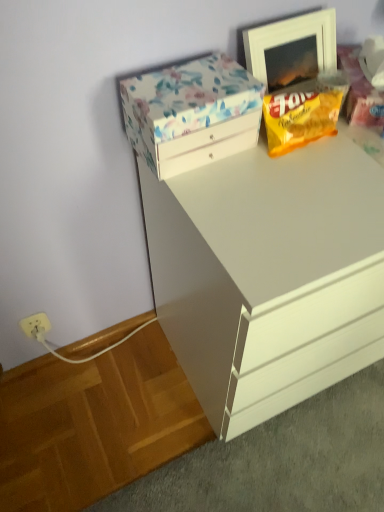
Question: Considering the positions of white glossy chest of drawers at upper center and floral-patterned cardboard box at upper left in the image, is white glossy chest of drawers at upper center taller or shorter than floral-patterned cardboard box at upper left?

Choices:
 (A) short
 (B) tall

Answer: (B)

Question: Looking at the image, does white glossy chest of drawers at upper center seem bigger or smaller compared to floral-patterned cardboard box at upper left?

Choices:
 (A) big
 (B) small

Answer: (A)

Question: Based on their relative distances, which object is farther from the yellow matte snack packet at upper right?

Choices:
 (A) white wooden picture frame at upper right
 (B) white glossy chest of drawers at upper center
 (C) floral-patterned cardboard box at upper left

Answer: (B)

Question: Estimate the real-world distances between objects in this image. Which object is closer to the floral-patterned cardboard box at upper left?

Choices:
 (A) yellow matte snack packet at upper right
 (B) white glossy chest of drawers at upper center
 (C) white wooden picture frame at upper right

Answer: (A)